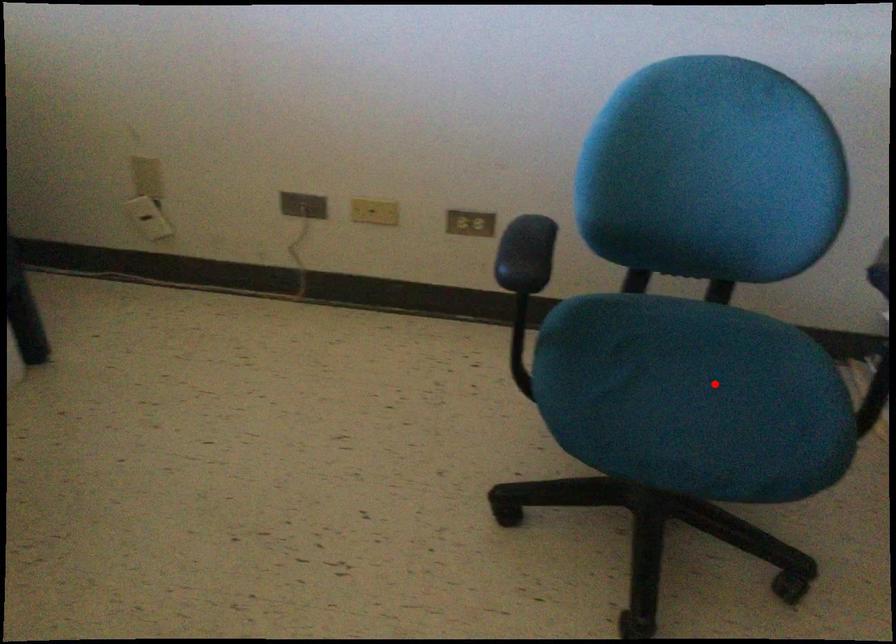
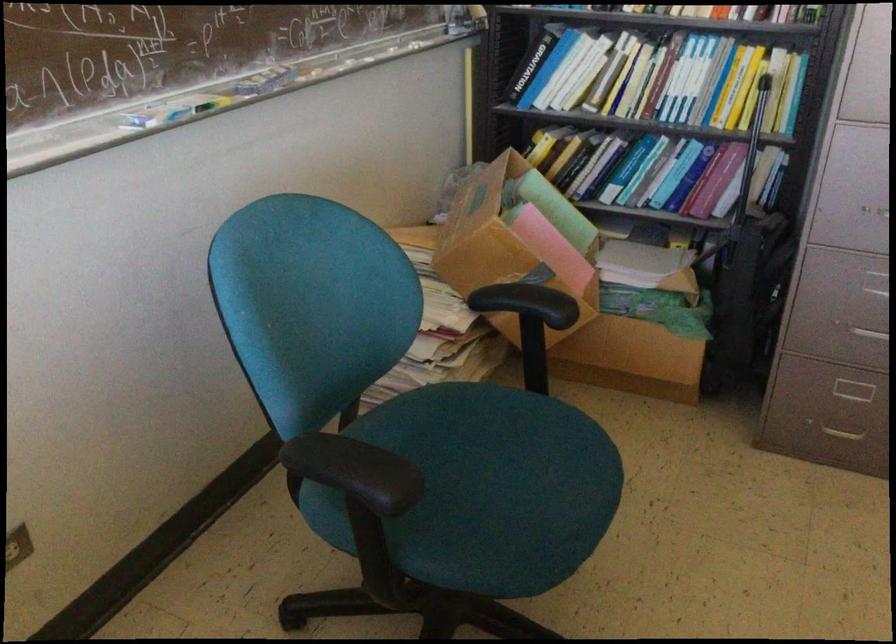
In the second image, find the point that corresponds to the highlighted location in the first image.

(498, 458)